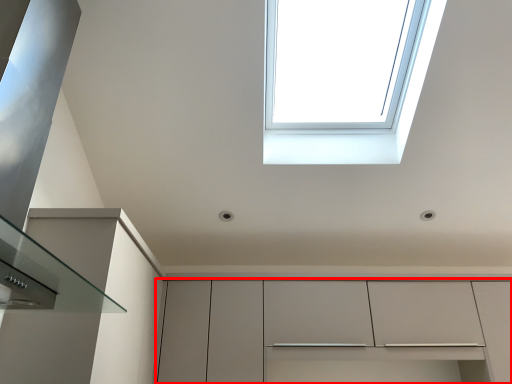
Question: Where is cabinetry (annotated by the red box) located in relation to window in the image?

Choices:
 (A) right
 (B) left

Answer: (A)